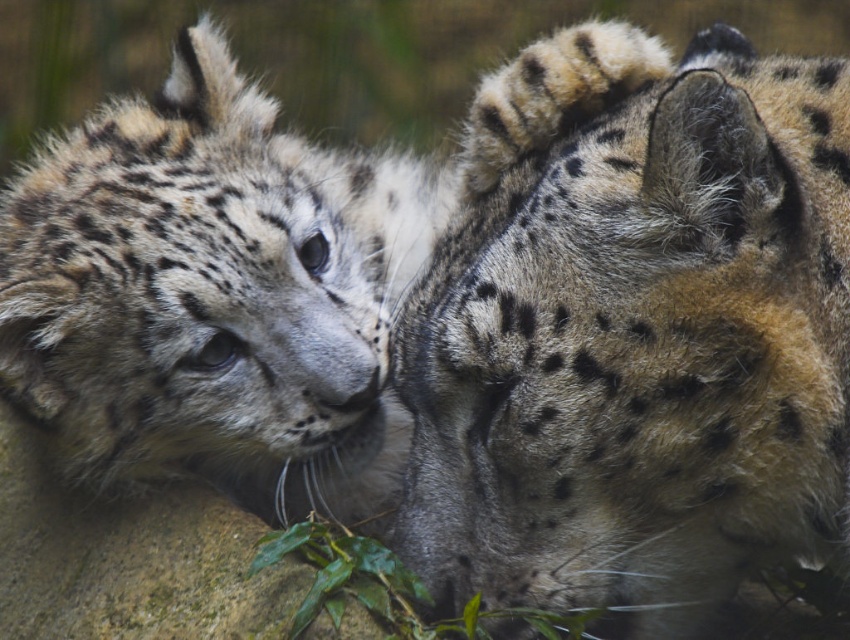
You are a wildlife photographer aiming to capture a photo of both the spotted fur cheetah at center and the spotted fur snow leopard at left. Given that your camera can only focus on one subject at a time, which animal should you adjust the focus to first if you want to ensure the taller animal is in focus first?

The spotted fur cheetah at center is taller than the spotted fur snow leopard at left. Therefore, you should adjust the focus to the spotted fur cheetah at center first to ensure the taller animal is in focus.

Consider the image. You are a wildlife photographer aiming to capture a close shot of the spotted fur cheetah at center and the spotted fur snow leopard at left. Which animal should you focus on first if you want to take a clear photo of the one closer to you?

The spotted fur cheetah at center is closer to the viewer than the spotted fur snow leopard at left, so you should focus on the spotted fur cheetah at center first to ensure a clear photo.

Looking at the image of the two snow leopards, which one is located higher up between the spotted fur cheetah at center and the spotted fur snow leopard at left?

The spotted fur snow leopard at left is higher up because the spotted fur cheetah at center is positioned under it.